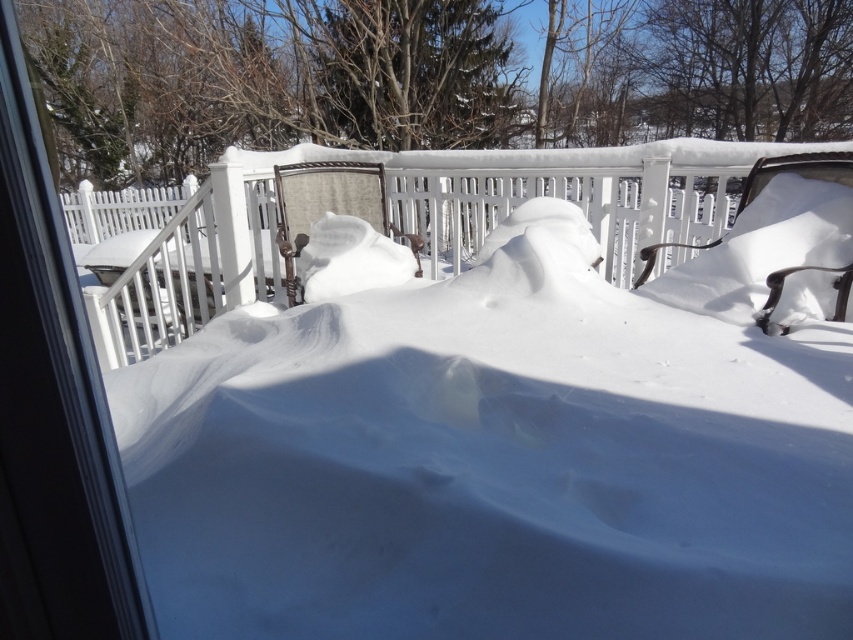
Question: In this image, where is white wood fence at center located relative to transparent plastic screen door at left?

Choices:
 (A) left
 (B) right

Answer: (A)

Question: Does white wood fence at center appear on the right side of transparent plastic screen door at left?

Choices:
 (A) yes
 (B) no

Answer: (B)

Question: Which of the following is the closest to the observer?

Choices:
 (A) transparent plastic screen door at left
 (B) white wood fence at center

Answer: (A)

Question: Considering the relative positions of white wood fence at center and transparent plastic screen door at left in the image provided, where is white wood fence at center located with respect to transparent plastic screen door at left?

Choices:
 (A) above
 (B) below

Answer: (A)